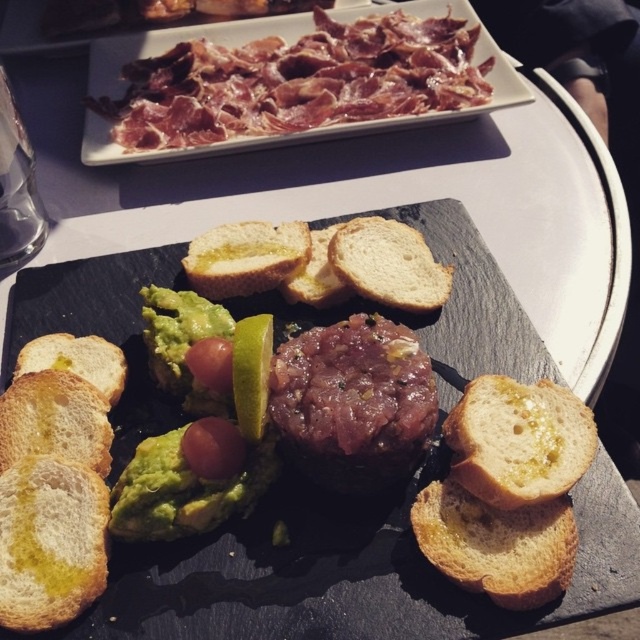
Question: Among these objects, which one is nearest to the camera?

Choices:
 (A) sliced cured meat at upper center
 (B) green creamy guacamole at center

Answer: (B)

Question: Does green creamy guacamole at center appear under golden crusty bread at center?

Choices:
 (A) yes
 (B) no

Answer: (A)

Question: Which point is closer to the camera?

Choices:
 (A) golden crusty bread at center
 (B) golden crispy bread at lower right
 (C) olive oil toasted bread at center
 (D) golden toasted bread at center

Answer: (B)

Question: Can you confirm if green creamy guacamole at center is positioned above golden toasted bread at center?

Choices:
 (A) yes
 (B) no

Answer: (B)

Question: Which point appears closest to the camera in this image?

Choices:
 (A) (48, 369)
 (B) (337, 253)
 (C) (483, 560)

Answer: (C)

Question: From the image, what is the correct spatial relationship of golden brown crusty bread at center in relation to golden crusty bread at center?

Choices:
 (A) below
 (B) above

Answer: (A)